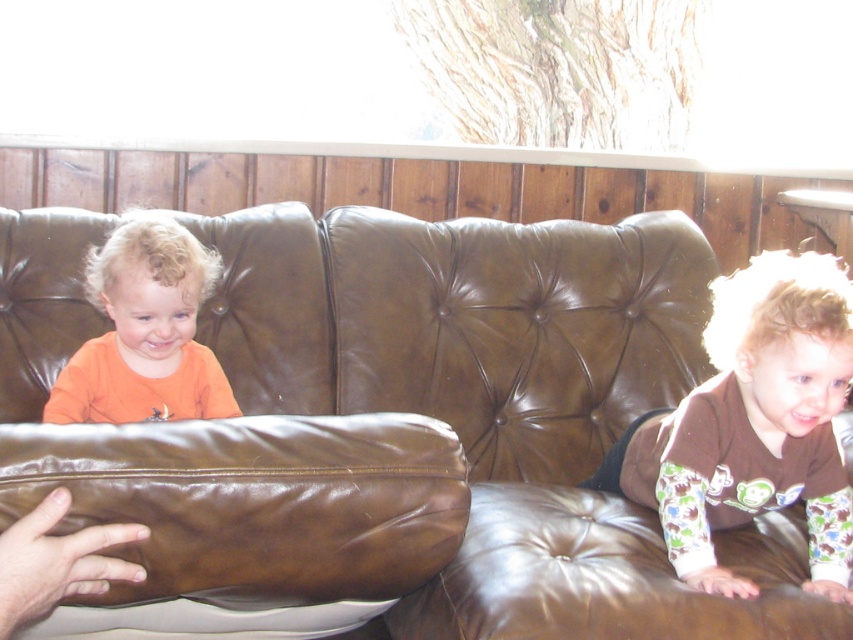
Can you confirm if orange matte shirt at left is positioned above brown leather hand at lower left?

Correct, orange matte shirt at left is located above brown leather hand at lower left.

Can you confirm if orange matte shirt at left is smaller than brown leather hand at lower left?

Incorrect, orange matte shirt at left is not smaller in size than brown leather hand at lower left.

Based on the photo, who is more distant from viewer, [144,228] or [70,552]?

Point [144,228]

Find the location of `orange matte shirt at left`. orange matte shirt at left is located at coordinates (144, 332).

Does brown cotton onesie at right appear on the left side of brown leather hand at lower left?

Incorrect, brown cotton onesie at right is not on the left side of brown leather hand at lower left.

Is point (790, 451) positioned before point (49, 518)?

No.

I want to click on brown cotton onesie at right, so click(x=755, y=424).

Is brown leather couch at center bigger than brown cotton onesie at right?

Indeed, brown leather couch at center has a larger size compared to brown cotton onesie at right.

Measure the distance between brown leather couch at center and camera.

1.03 meters

The width and height of the screenshot is (853, 640). Find the location of `brown leather couch at center`. brown leather couch at center is located at coordinates (399, 424).